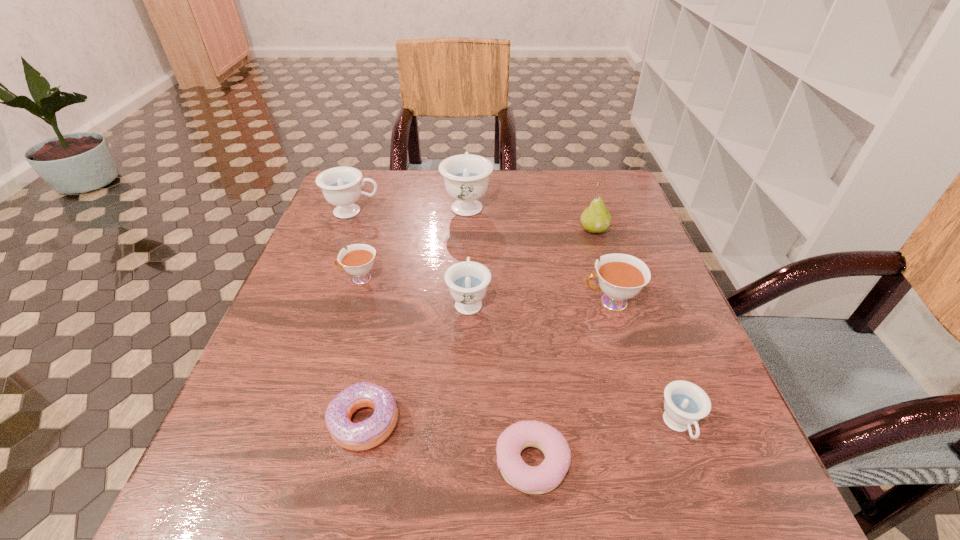
This screenshot has width=960, height=540. I want to click on free spot that satisfies the following two spatial constraints: 1. on the side of the right purple doughnut with the handle; 2. on the left side of the leftmost blue teacup, so click(x=258, y=462).

This screenshot has height=540, width=960. I want to click on free location that satisfies the following two spatial constraints: 1. on the back side of the green pear; 2. on the side of the second biggest blue teacup with the handle, so click(588, 212).

The width and height of the screenshot is (960, 540). In order to click on vacant area that satisfies the following two spatial constraints: 1. on the side of the left white teacup with the handle; 2. on the left side of the left doughnut in this screenshot , I will do `click(316, 422)`.